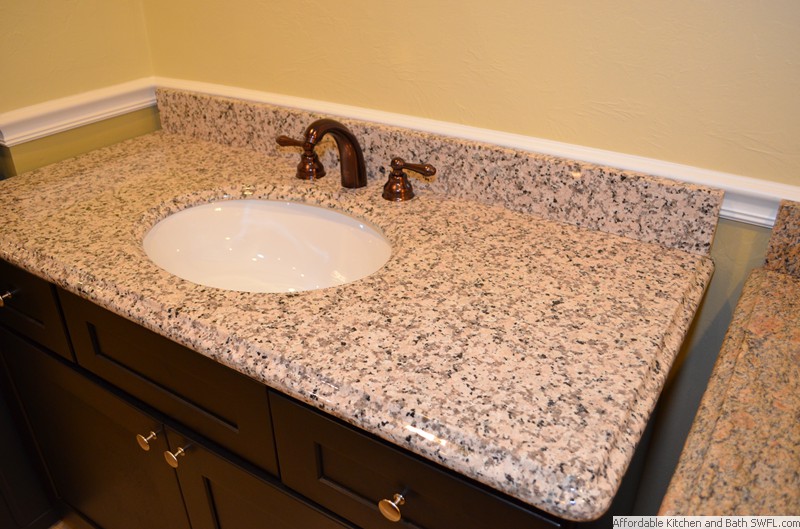
Locate an element on the screen. Image resolution: width=800 pixels, height=529 pixels. yellow wall is located at coordinates (589, 72).